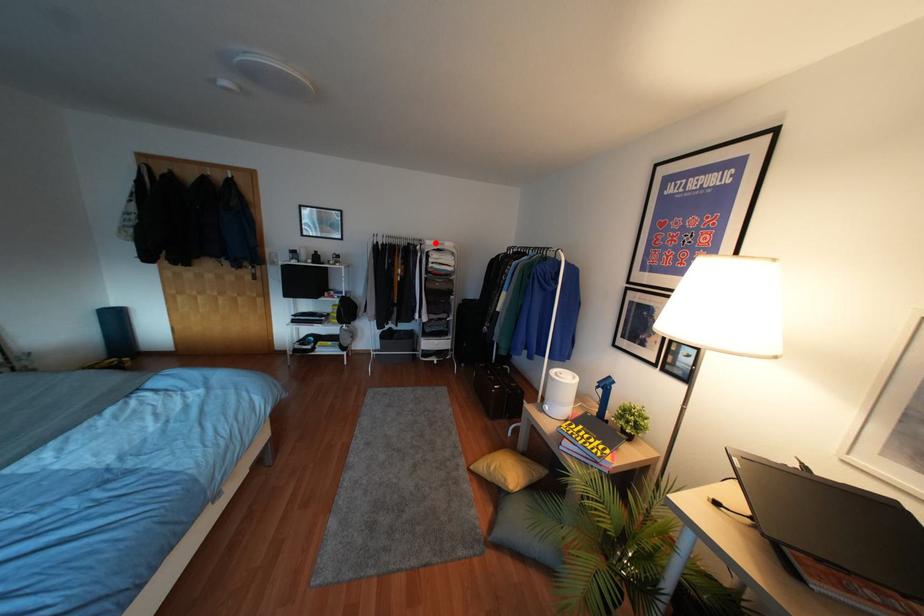
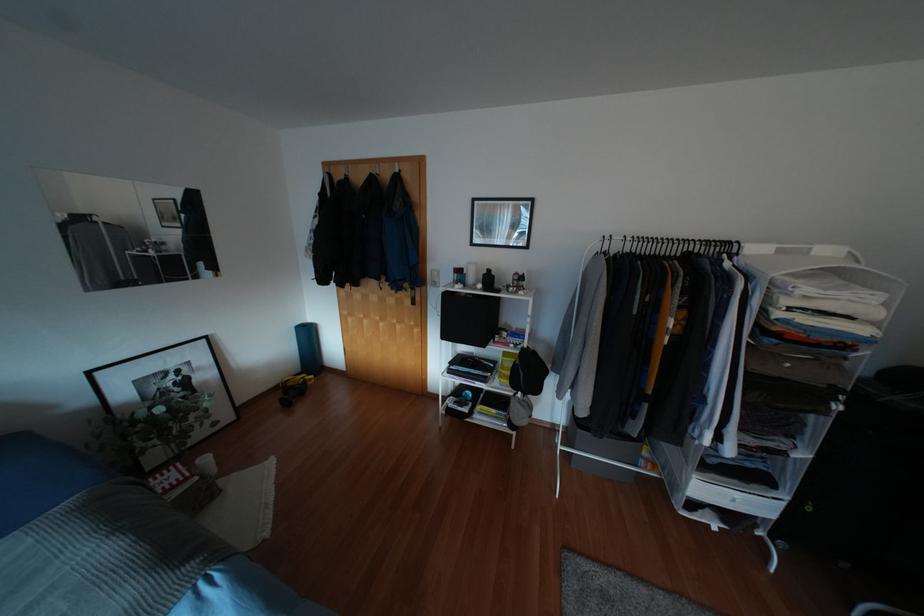
Locate, in the second image, the point that corresponds to the highlighted location in the first image.

(779, 251)